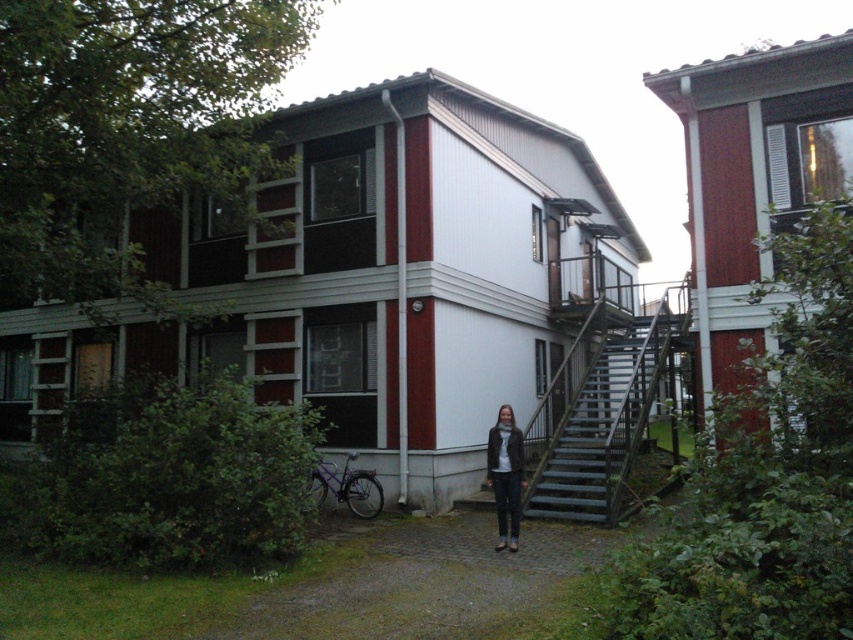
You are a delivery person carrying a package and need to climb the metallic gray stairs at center. You notice the leather jacket at center nearby. Which object is shorter in height between the two?

The metallic gray stairs at center has a lesser height compared to the leather jacket at center, so the stairs are shorter.

You are standing in front of the residential building and want to reach the entrance. There are metallic gray stairs at center and a leather jacket at center in your view. Which object should you interact with first to reach the entrance?

The metallic gray stairs at center is located below the leather jacket at center, so you should interact with the metallic gray stairs at center first to reach the entrance.